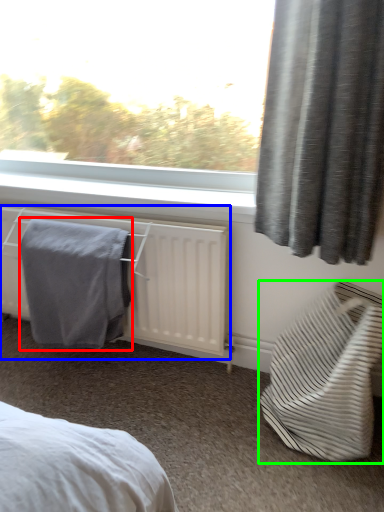
Question: Which object is positioned closest to bath towel (highlighted by a red box)? Select from radiator (highlighted by a blue box) and furniture (highlighted by a green box).

Choices:
 (A) radiator
 (B) furniture

Answer: (A)